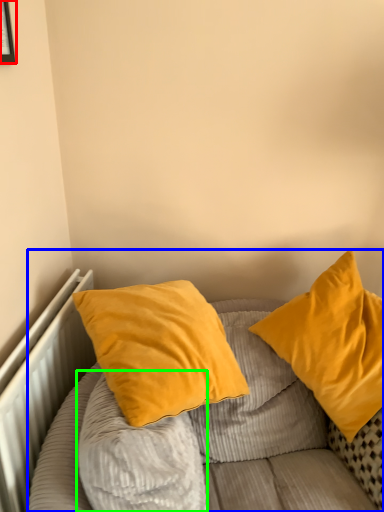
Question: Which is nearer to the picture frame (highlighted by a red box)? bed (highlighted by a blue box) or pillow (highlighted by a green box).

Choices:
 (A) bed
 (B) pillow

Answer: (B)